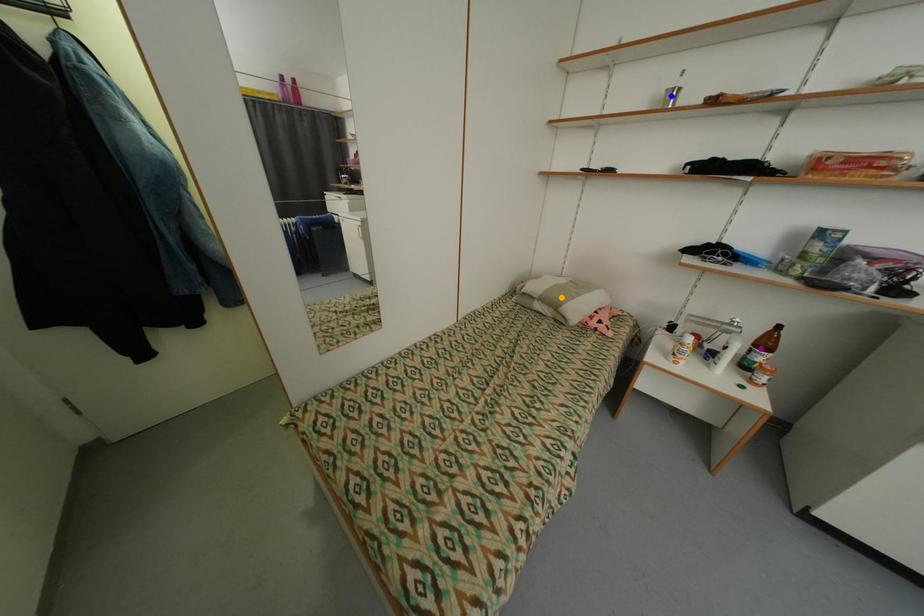
Order these from farthest to nearest:
- purple point
- blue point
- orange point

orange point < blue point < purple point